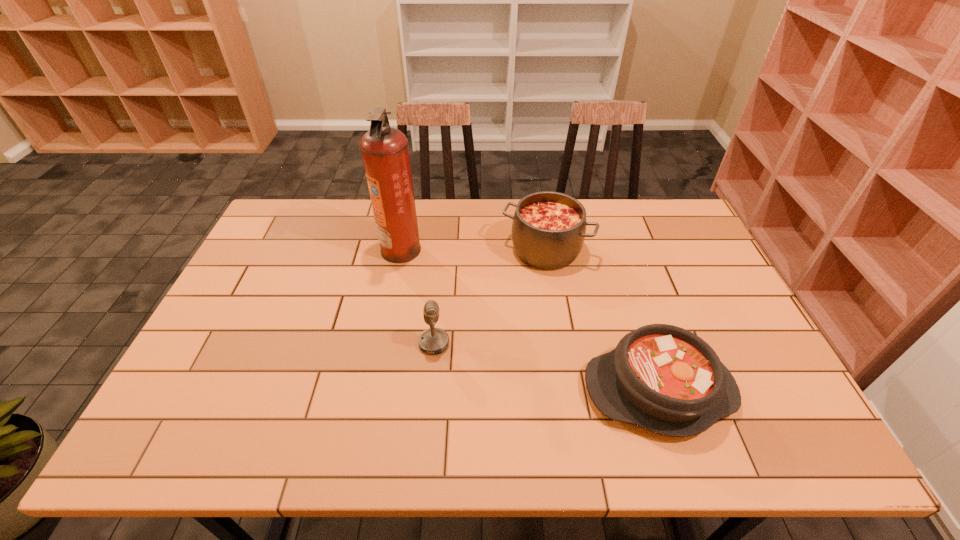
Identify the location of fire extinguisher situated at the far edge. Image resolution: width=960 pixels, height=540 pixels. (385, 152).

The width and height of the screenshot is (960, 540). I want to click on casserole positioned at the far edge, so click(548, 230).

Identify the location of object that is at the near edge. The width and height of the screenshot is (960, 540). (663, 378).

Where is `object situated at the right edge`? This screenshot has height=540, width=960. object situated at the right edge is located at coordinates (663, 378).

Image resolution: width=960 pixels, height=540 pixels. I want to click on object that is positioned at the near right corner, so click(x=663, y=378).

In the image, there is a desktop. Where is `vacant space at the far edge`? This screenshot has width=960, height=540. vacant space at the far edge is located at coordinates (334, 214).

Identify the location of vacant space at the near edge of the desktop. (611, 453).

In order to click on vacant space at the left edge in this screenshot , I will do `click(283, 247)`.

The width and height of the screenshot is (960, 540). What are the coordinates of `free space at the right edge of the desktop` in the screenshot? It's located at (759, 405).

Find the location of a particular element. The image size is (960, 540). vacant space at the far left corner of the desktop is located at coordinates (302, 227).